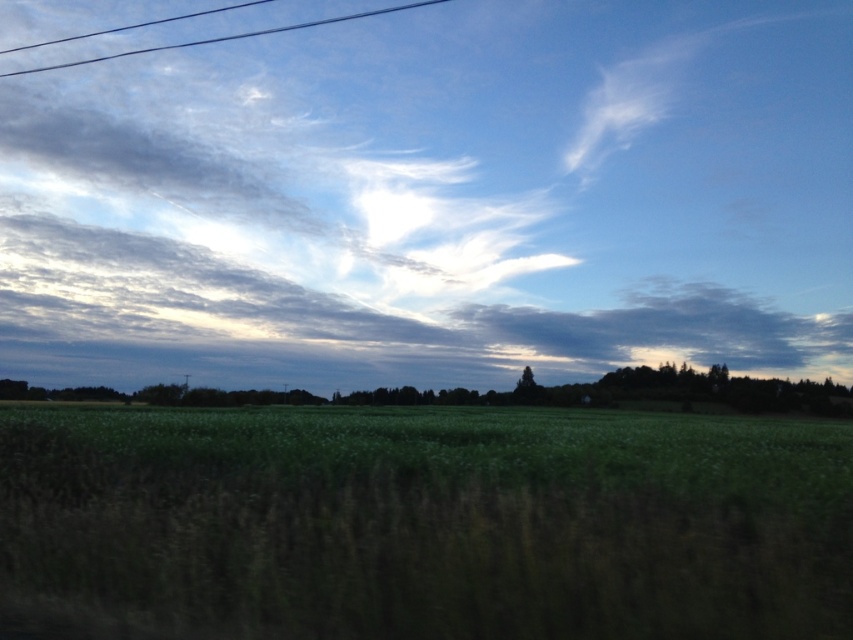
Which is below, green grass at center or black wire at upper left?

green grass at center is lower down.

Is green grass at center taller than black wire at upper left?

No, green grass at center is not taller than black wire at upper left.

This screenshot has height=640, width=853. What are the coordinates of `green grass at center` in the screenshot? It's located at (x=428, y=522).

Find the location of a particular element. This screenshot has width=853, height=640. green grass at center is located at coordinates (428, 522).